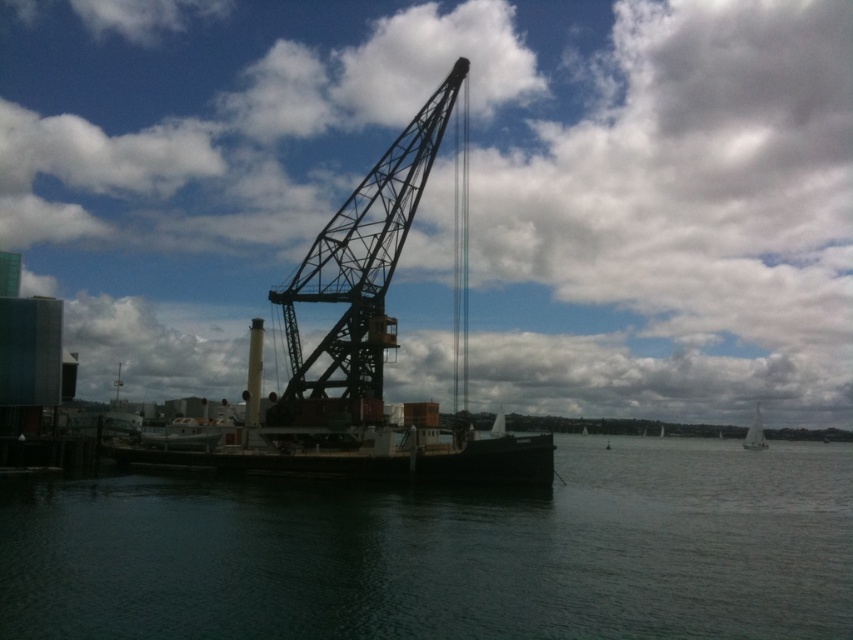
Question: Which object is the closest to the dark matte water at center?

Choices:
 (A) dark green metallic crane at center
 (B) white sailboat at right

Answer: (A)

Question: Is dark matte water at center above metallic industrial crane at center?

Choices:
 (A) yes
 (B) no

Answer: (B)

Question: Is dark green metallic crane at center wider than white sailboat at right?

Choices:
 (A) yes
 (B) no

Answer: (A)

Question: Can you confirm if dark matte water at center is positioned to the right of dark green metallic crane at center?

Choices:
 (A) yes
 (B) no

Answer: (A)

Question: Which point is closer to the camera?

Choices:
 (A) (693, 584)
 (B) (747, 436)
 (C) (459, 435)

Answer: (A)

Question: Which point appears closest to the camera in this image?

Choices:
 (A) (316, 291)
 (B) (515, 518)
 (C) (756, 403)

Answer: (B)